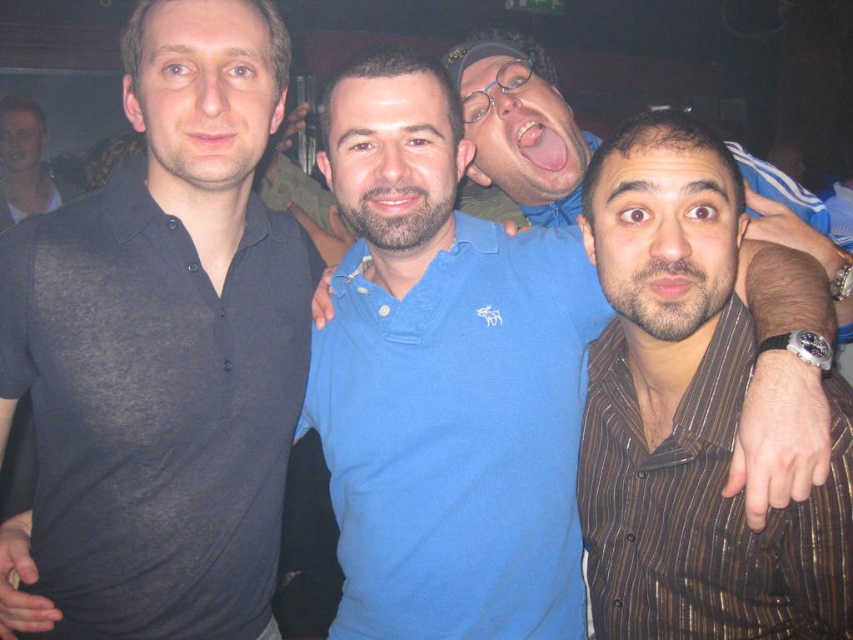
Question: Among these points, which one is farthest from the camera?

Choices:
 (A) (694, 452)
 (B) (428, 340)

Answer: (B)

Question: Considering the relative positions of blue cotton polo shirt at center and brown striped shirt at center in the image provided, where is blue cotton polo shirt at center located with respect to brown striped shirt at center?

Choices:
 (A) right
 (B) left

Answer: (B)

Question: Considering the relative positions of blue cotton polo shirt at center and brown striped shirt at center in the image provided, where is blue cotton polo shirt at center located with respect to brown striped shirt at center?

Choices:
 (A) right
 (B) left

Answer: (B)

Question: Which object appears closest to the camera in this image?

Choices:
 (A) blue cotton polo shirt at center
 (B) dark gray sheer shirt at left
 (C) brown striped shirt at center

Answer: (C)

Question: Estimate the real-world distances between objects in this image. Which object is farther from the dark gray sheer shirt at left?

Choices:
 (A) brown striped shirt at center
 (B) blue cotton polo shirt at center

Answer: (A)

Question: From the image, what is the correct spatial relationship of dark gray sheer shirt at left in relation to blue cotton polo shirt at center?

Choices:
 (A) left
 (B) right

Answer: (A)